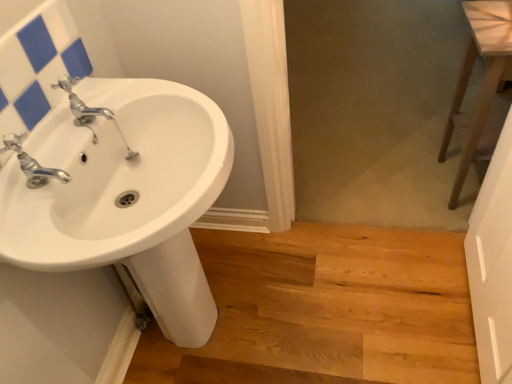
Find the location of a particular element. The width and height of the screenshot is (512, 384). vacant area that is in front of silver metallic faucet at left is located at coordinates (42, 232).